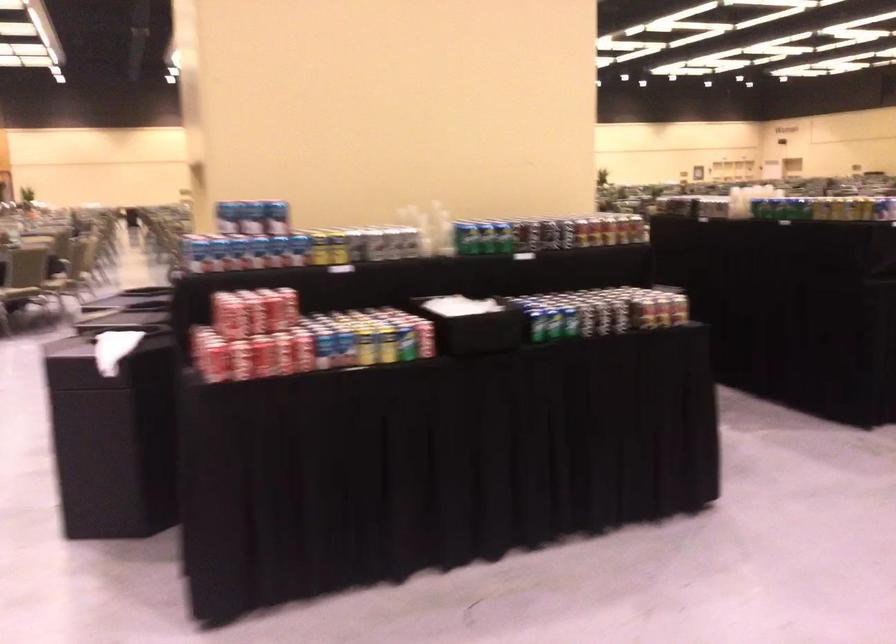
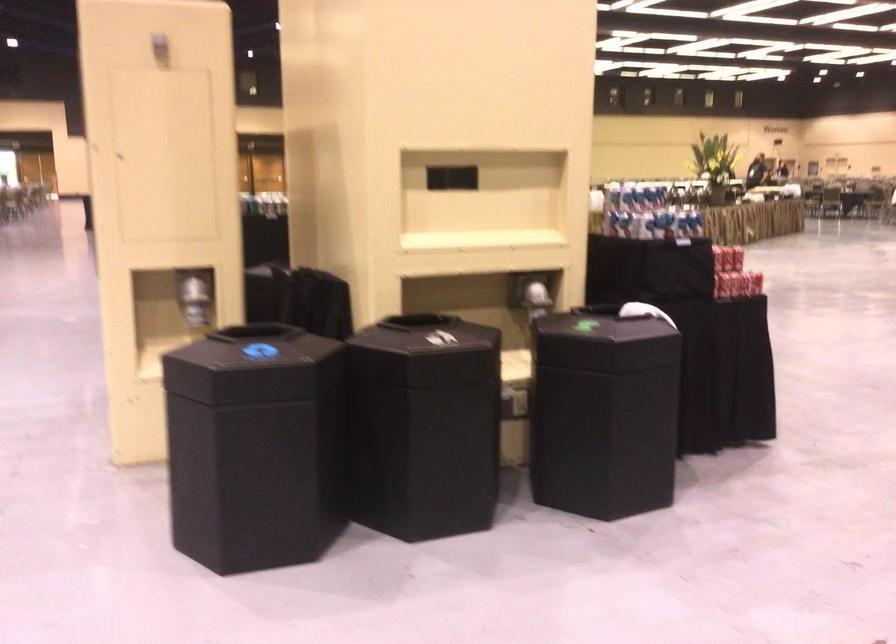
Question: I am providing you with two images of the same scene from different viewpoints. After the viewpoint changes to image2, which objects are now occluded?

Choices:
 (A) black bin lid
 (B) yellow soda can
 (C) green thumbtack
 (D) shiny dispenser lever

Answer: (B)